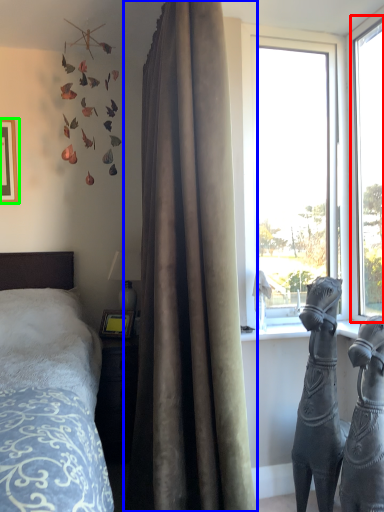
Question: Considering the real-world distances, which object is farthest from window (highlighted by a red box)? curtain (highlighted by a blue box) or picture frame (highlighted by a green box)?

Choices:
 (A) curtain
 (B) picture frame

Answer: (B)